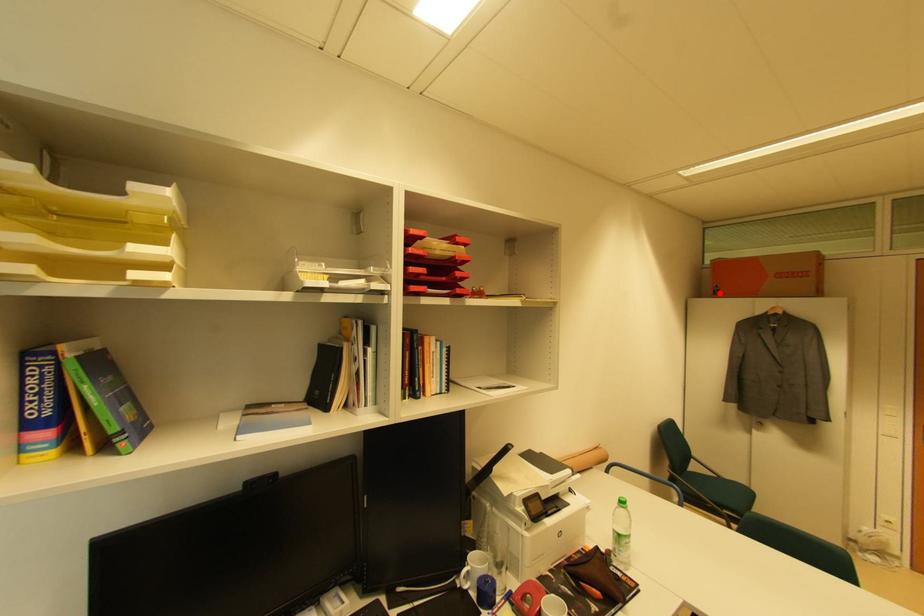
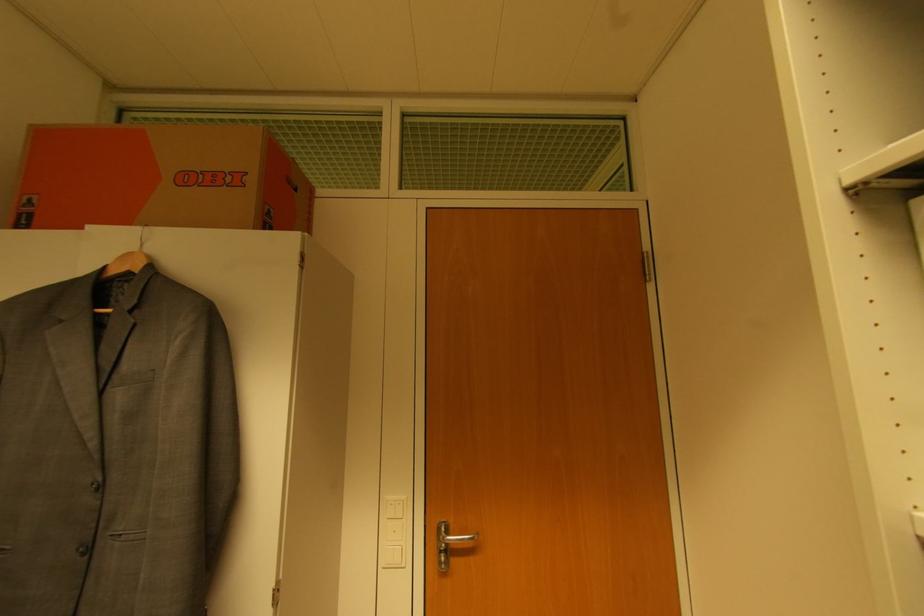
Find the pixel in the second image that matches the highlighted location in the first image.

(32, 217)